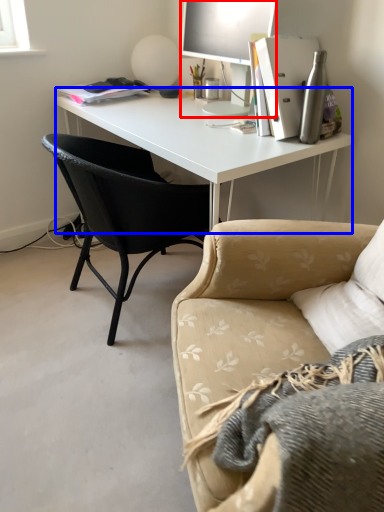
Question: Among these objects, which one is nearest to the camera, television (highlighted by a red box) or desk (highlighted by a blue box)?

Choices:
 (A) television
 (B) desk

Answer: (B)